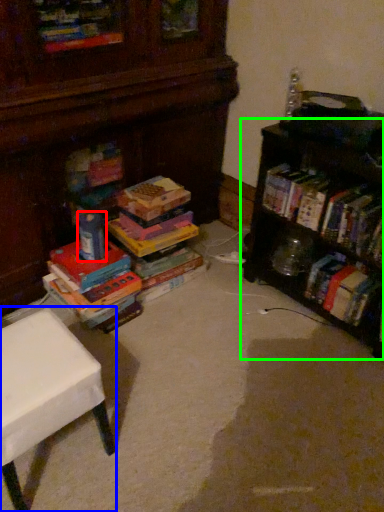
Question: Which object is the farthest from toy (highlighted by a red box)? Choose among these: table (highlighted by a blue box) or shelf (highlighted by a green box).

Choices:
 (A) table
 (B) shelf

Answer: (B)